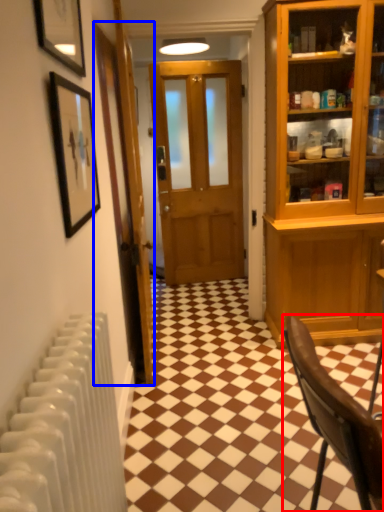
Question: Which of the following is the farthest to the observer, chair (highlighted by a red box) or door (highlighted by a blue box)?

Choices:
 (A) chair
 (B) door

Answer: (B)